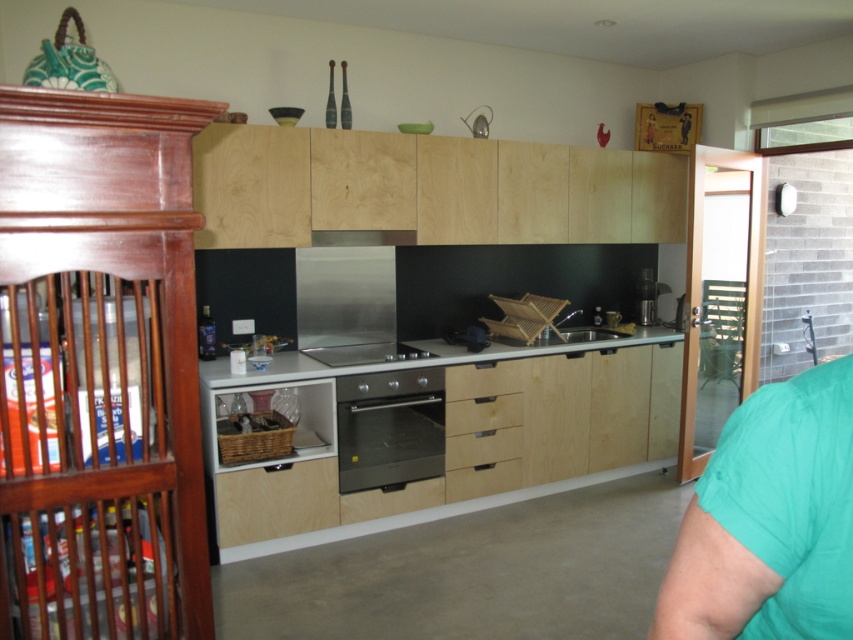
You are a kitchen designer and need to install a new microwave above the existing appliances. The microwave requires at least 15 cm of clearance above it. Given the current setup, can you place the microwave above the stainless steel oven at center or the stainless steel stove at center?

The stainless steel oven at center is much taller than the stainless steel stove at center. Since the microwave needs 15 cm clearance above it, placing it above the taller stainless steel oven at center would leave less vertical space compared to the stove. Therefore, the microwave should be placed above the stainless steel stove at center to ensure sufficient clearance.

You are organizing a kitchen and need to place a teal fabric shirt at lower right and a stainless steel exhaust hood at center. Which object has a smaller width?

The teal fabric shirt at lower right is thinner than the stainless steel exhaust hood at center, so the teal fabric shirt at lower right has a smaller width.

You are organizing a kitchen and need to place a tall vase on the countertop. The teal fabric shirt at lower right and the stainless steel exhaust hood at center are already there. Which object should you place the vase next to if you want it to be taller than both?

The teal fabric shirt at lower right is taller than the stainless steel exhaust hood at center, so placing the vase next to the teal fabric shirt at lower right would allow it to be taller than both.